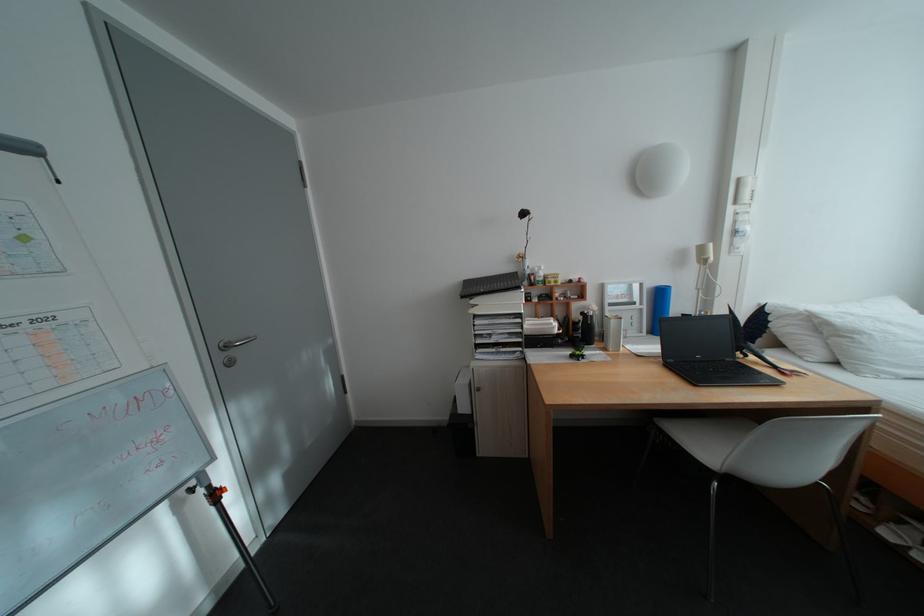
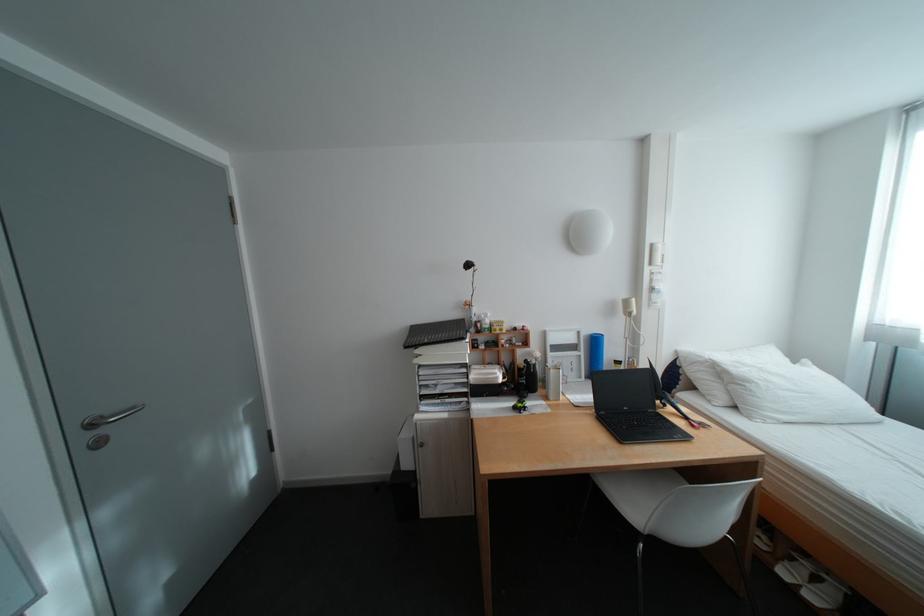
In the second image, find the point that corresponds to (242,342) in the first image.

(115, 418)